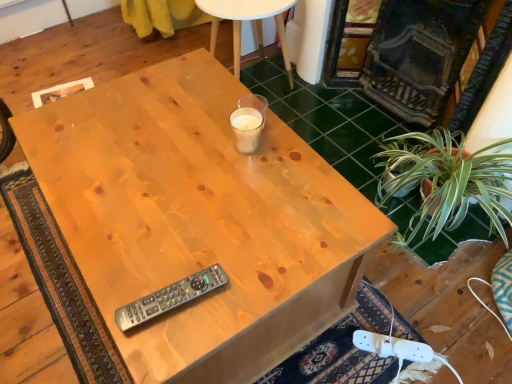
Identify the location of vacant space in front of white paper cup at center, positioned as the first coffee cup in top-to-bottom order. (249, 165).